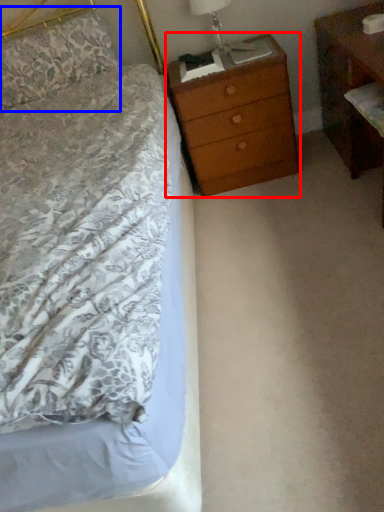
Question: Which point is further to the camera, chest of drawers (highlighted by a red box) or pillow (highlighted by a blue box)?

Choices:
 (A) chest of drawers
 (B) pillow

Answer: (B)